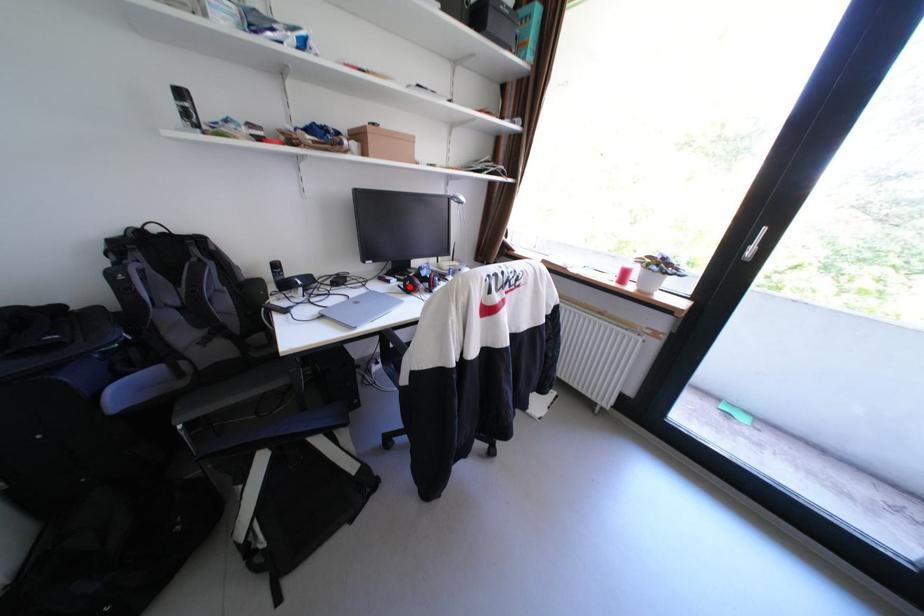
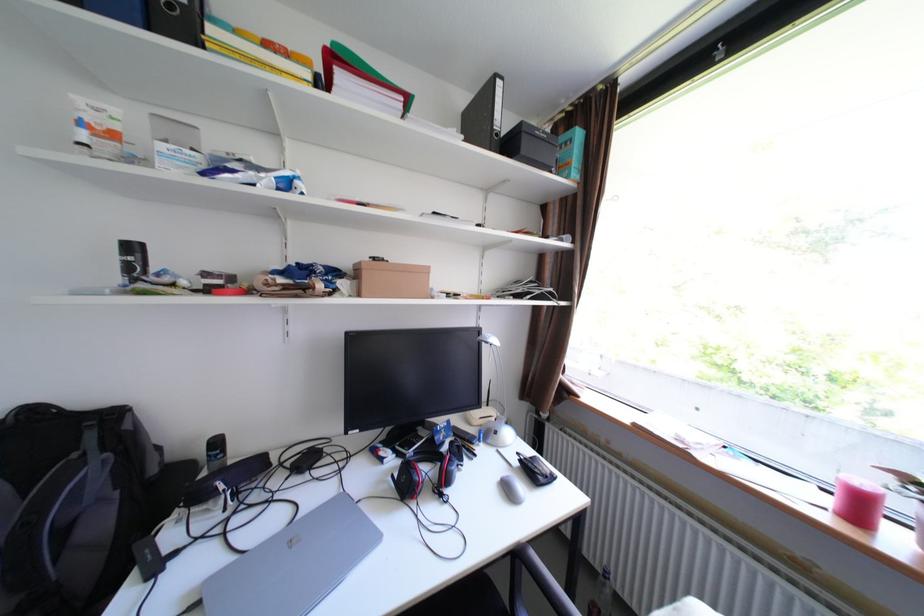
Locate, in the second image, the point that corresponds to the highlighted location in the first image.

(403, 477)